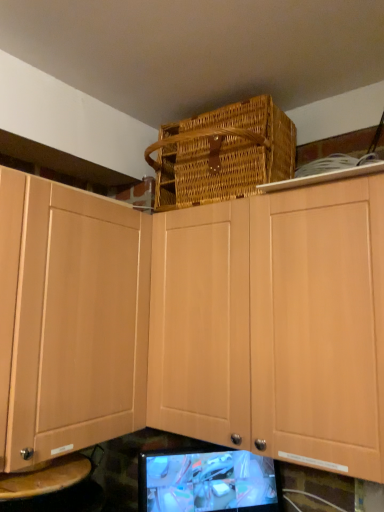
Question: Considering the relative positions of light wood cabinet at upper center and matte black monitor at lower center in the image provided, is light wood cabinet at upper center to the right of matte black monitor at lower center from the viewer's perspective?

Choices:
 (A) no
 (B) yes

Answer: (B)

Question: Are light wood cabinet at upper center and matte black monitor at lower center located far from each other?

Choices:
 (A) no
 (B) yes

Answer: (A)

Question: Is the surface of light wood cabinet at upper center in direct contact with matte black monitor at lower center?

Choices:
 (A) yes
 (B) no

Answer: (B)

Question: Does light wood cabinet at upper center have a smaller size compared to matte black monitor at lower center?

Choices:
 (A) no
 (B) yes

Answer: (A)

Question: From a real-world perspective, is light wood cabinet at upper center positioned under matte black monitor at lower center based on gravity?

Choices:
 (A) no
 (B) yes

Answer: (A)

Question: Considering the relative positions of woven brown basket at upper center and matte black monitor at lower center in the image provided, is woven brown basket at upper center to the left or to the right of matte black monitor at lower center?

Choices:
 (A) right
 (B) left

Answer: (A)

Question: Is woven brown basket at upper center spatially inside matte black monitor at lower center, or outside of it?

Choices:
 (A) inside
 (B) outside

Answer: (B)

Question: From the image's perspective, is woven brown basket at upper center above or below matte black monitor at lower center?

Choices:
 (A) above
 (B) below

Answer: (A)

Question: Relative to matte black monitor at lower center, is woven brown basket at upper center in front or behind?

Choices:
 (A) behind
 (B) front

Answer: (B)

Question: From a real-world perspective, is matte black monitor at lower center physically located above or below woven brown basket at upper center?

Choices:
 (A) above
 (B) below

Answer: (B)

Question: Is matte black monitor at lower center to the left or to the right of woven brown basket at upper center in the image?

Choices:
 (A) right
 (B) left

Answer: (B)

Question: Is matte black monitor at lower center in front of or behind woven brown basket at upper center in the image?

Choices:
 (A) behind
 (B) front

Answer: (A)

Question: Do you think matte black monitor at lower center is within woven brown basket at upper center, or outside of it?

Choices:
 (A) outside
 (B) inside

Answer: (A)

Question: Is light wood cabinet at upper center taller or shorter than matte black monitor at lower center?

Choices:
 (A) short
 (B) tall

Answer: (B)

Question: Choose the correct answer: Is light wood cabinet at upper center inside matte black monitor at lower center or outside it?

Choices:
 (A) outside
 (B) inside

Answer: (A)